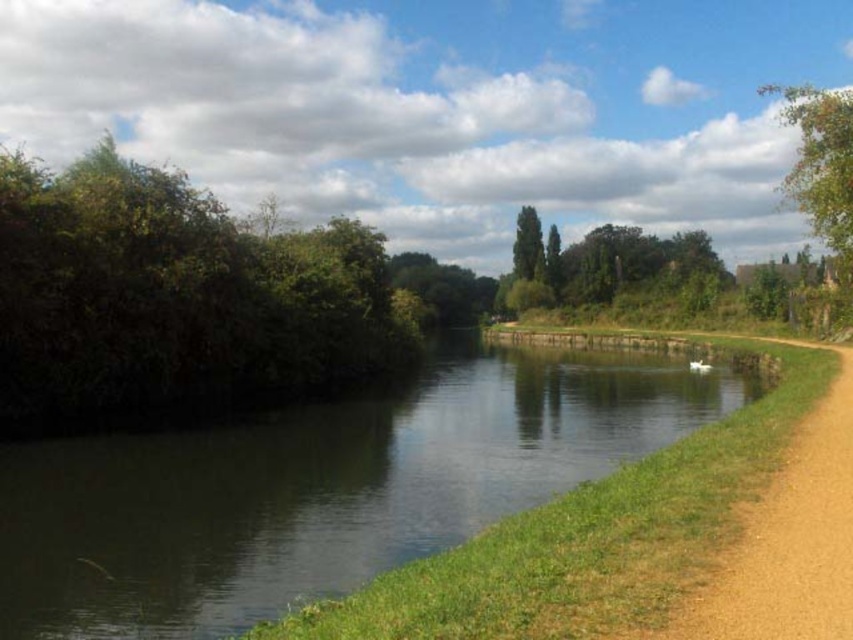
Question: Which of the following is the closest to the observer?

Choices:
 (A) green leafy tree at center
 (B) brown dirt path at lower right
 (C) green smooth water at center

Answer: (B)

Question: Which point appears farthest from the camera in this image?

Choices:
 (A) (322, 333)
 (B) (808, 621)
 (C) (827, 129)
 (D) (229, 436)

Answer: (A)

Question: Does green leafy tree at upper right appear on the left side of green leafy tree at center?

Choices:
 (A) yes
 (B) no

Answer: (B)

Question: Can you confirm if green smooth water at center is wider than brown dirt path at lower right?

Choices:
 (A) yes
 (B) no

Answer: (A)

Question: Among these objects, which one is nearest to the camera?

Choices:
 (A) green leafy bush at left
 (B) green leafy tree at upper right
 (C) green leafy tree at center
 (D) green smooth water at center

Answer: (D)

Question: Is the position of green smooth water at center more distant than that of green leafy tree at upper right?

Choices:
 (A) yes
 (B) no

Answer: (B)